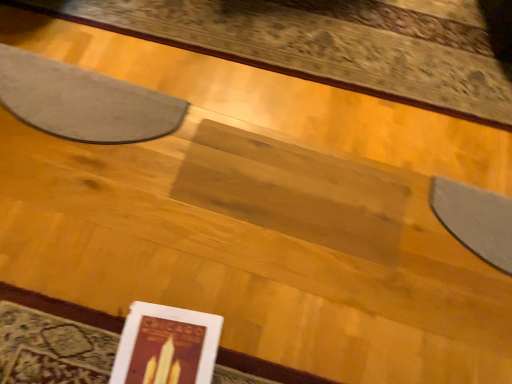
Where is `vacant area situated to the left side of matte paper book at lower left`? The image size is (512, 384). vacant area situated to the left side of matte paper book at lower left is located at coordinates (73, 328).